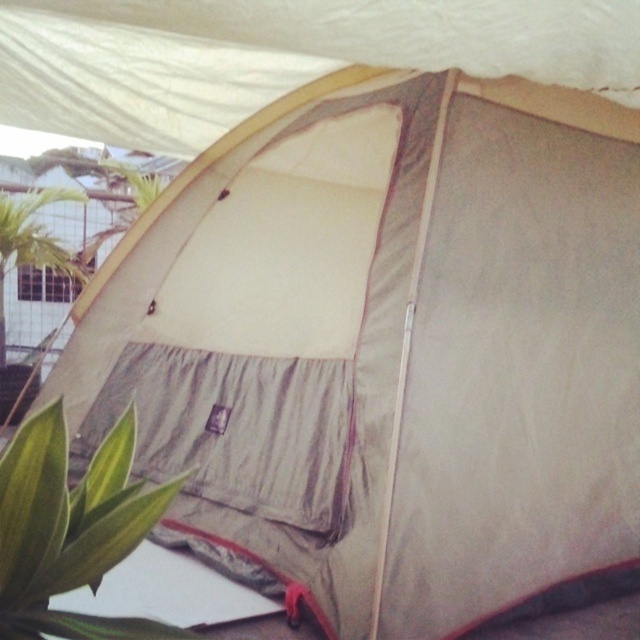
Question: Which object is farther from the camera taking this photo?

Choices:
 (A) green leafy plant at left
 (B) beige fabric tent at upper center
 (C) green leafy plant at lower left

Answer: (A)

Question: Which of the following is the closest to the observer?

Choices:
 (A) (22, 264)
 (B) (120, 176)
 (C) (13, 484)

Answer: (C)

Question: Does green leafy plant at lower left have a lesser width compared to green leafy plant at left?

Choices:
 (A) yes
 (B) no

Answer: (A)

Question: Does green leafy plant at left have a larger size compared to green leafy plant at upper left?

Choices:
 (A) yes
 (B) no

Answer: (A)

Question: Which object is the closest to the green leafy plant at left?

Choices:
 (A) green leafy plant at lower left
 (B) beige fabric tent at upper center

Answer: (B)

Question: In this image, where is green leafy plant at lower left located relative to green leafy plant at left?

Choices:
 (A) left
 (B) right

Answer: (B)